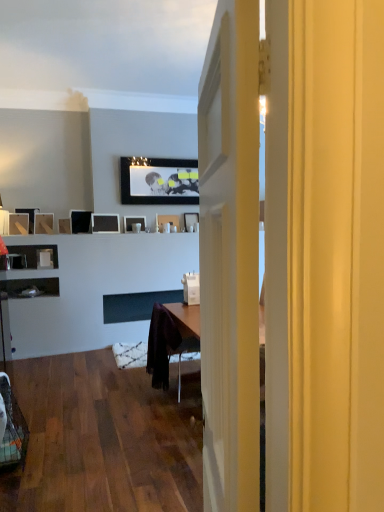
You are a GUI agent. You are given a task and a screenshot of the screen. Output one action in this format:
    pyautogui.click(x=<x>, y=<y>)
    Task: Click on the matte black picture frame at center, which ranks as the seventh picture frame in left-to-right order
    The image size is (384, 512).
    Given the screenshot: What is the action you would take?
    pyautogui.click(x=134, y=223)

Find the location of `matte black picture frame at center, placed as the fifth picture frame when sorted from left to right`. matte black picture frame at center, placed as the fifth picture frame when sorted from left to right is located at coordinates click(x=80, y=221).

Measure the distance between point (164, 358) and camera.

The distance of point (164, 358) from camera is 3.93 meters.

Where is `matte black picture frame at center, the fifth picture frame when ordered from right to left`? This screenshot has width=384, height=512. matte black picture frame at center, the fifth picture frame when ordered from right to left is located at coordinates (105, 223).

You are a GUI agent. You are given a task and a screenshot of the screen. Output one action in this format:
    pyautogui.click(x=<x>, y=<y>)
    Task: Click on the matte black picture frame at left, which is the tenth picture frame in right-to-left order
    The image size is (384, 512).
    Given the screenshot: What is the action you would take?
    pyautogui.click(x=29, y=216)

At what (x,y) coordinates should I click in order to perform the action: click on matte black picture frame at upper center, which ranks as the 8th picture frame in left-to-right order. Please return your answer as a coordinate pair (x, y). This screenshot has height=512, width=384. Looking at the image, I should click on (159, 181).

Considering the relative sizes of purple fabric chair at center and matte black picture frame at center, which ranks as the seventh picture frame in left-to-right order, in the image provided, is purple fabric chair at center thinner than matte black picture frame at center, which ranks as the seventh picture frame in left-to-right order,?

In fact, purple fabric chair at center might be wider than matte black picture frame at center, which ranks as the seventh picture frame in left-to-right order.

Is purple fabric chair at center completely or partially outside of matte black picture frame at center, which ranks as the seventh picture frame in left-to-right order?

Absolutely, purple fabric chair at center is external to matte black picture frame at center, which ranks as the seventh picture frame in left-to-right order.

From the image's perspective, is purple fabric chair at center located above or below matte black picture frame at center, which ranks as the seventh picture frame in left-to-right order?

Clearly, from the image's perspective, purple fabric chair at center is below matte black picture frame at center, which ranks as the seventh picture frame in left-to-right order.

Is purple fabric chair at center at the left side of matte black picture frame at center, which ranks as the 4th picture frame in right-to-left order?

No, purple fabric chair at center is not to the left of matte black picture frame at center, which ranks as the 4th picture frame in right-to-left order.

Who is smaller, matte wood picture frame at left, which is counted as the eighth picture frame, starting from the right, or matte black picture frame at upper center, which appears as the third picture frame when viewed from the right?

matte wood picture frame at left, which is counted as the eighth picture frame, starting from the right.

Is matte wood picture frame at left, which is counted as the eighth picture frame, starting from the right, shorter than matte black picture frame at upper center, which ranks as the 8th picture frame in left-to-right order?

Indeed, matte wood picture frame at left, which is counted as the eighth picture frame, starting from the right, has a lesser height compared to matte black picture frame at upper center, which ranks as the 8th picture frame in left-to-right order.

Can we say matte wood picture frame at left, the 3th picture frame positioned from the left, lies outside matte black picture frame at upper center, which ranks as the 8th picture frame in left-to-right order?

That's correct, matte wood picture frame at left, the 3th picture frame positioned from the left, is outside of matte black picture frame at upper center, which ranks as the 8th picture frame in left-to-right order.

Considering the relative sizes of matte wood picture frame at left, which is counted as the eighth picture frame, starting from the right, and matte black picture frame at upper center, which appears as the third picture frame when viewed from the right, in the image provided, is matte wood picture frame at left, which is counted as the eighth picture frame, starting from the right, thinner than matte black picture frame at upper center, which appears as the third picture frame when viewed from the right,?

No.

In the scene shown: Which is correct: matte wood picture frame at left, which is counted as the eighth picture frame, starting from the right, is inside matte black picture frame at left, positioned as the first picture frame in left-to-right order, or outside of it?

matte wood picture frame at left, which is counted as the eighth picture frame, starting from the right, exists outside the volume of matte black picture frame at left, positioned as the first picture frame in left-to-right order.

Considering the relative sizes of matte wood picture frame at left, the 3th picture frame positioned from the left, and matte black picture frame at left, positioned as the first picture frame in left-to-right order, in the image provided, is matte wood picture frame at left, the 3th picture frame positioned from the left, wider than matte black picture frame at left, positioned as the first picture frame in left-to-right order,?

Yes, matte wood picture frame at left, the 3th picture frame positioned from the left, is wider than matte black picture frame at left, positioned as the first picture frame in left-to-right order.

From the image's perspective, which is below, matte wood picture frame at left, which is counted as the eighth picture frame, starting from the right, or matte black picture frame at left, which is the tenth picture frame in right-to-left order?

matte wood picture frame at left, which is counted as the eighth picture frame, starting from the right, is shown below in the image.

Is matte wood picture frame at left, the 3th picture frame positioned from the left, not close to matte black picture frame at left, which is the tenth picture frame in right-to-left order?

That's not correct — matte wood picture frame at left, the 3th picture frame positioned from the left, is a little close to matte black picture frame at left, which is the tenth picture frame in right-to-left order.

Is matte black picture frame at left, positioned as the first picture frame in left-to-right order, positioned with its back to matte black picture frame at upper center, which appears as the third picture frame when viewed from the right?

No, matte black picture frame at left, positioned as the first picture frame in left-to-right order, is not facing away from matte black picture frame at upper center, which appears as the third picture frame when viewed from the right.

Considering the sizes of matte black picture frame at left, positioned as the first picture frame in left-to-right order, and matte black picture frame at upper center, which ranks as the 8th picture frame in left-to-right order, in the image, is matte black picture frame at left, positioned as the first picture frame in left-to-right order, wider or thinner than matte black picture frame at upper center, which ranks as the 8th picture frame in left-to-right order,?

In the image, matte black picture frame at left, positioned as the first picture frame in left-to-right order, appears to be wider than matte black picture frame at upper center, which ranks as the 8th picture frame in left-to-right order.

From the picture: Considering the relative sizes of matte black picture frame at left, which is the tenth picture frame in right-to-left order, and matte black picture frame at upper center, which appears as the third picture frame when viewed from the right, in the image provided, is matte black picture frame at left, which is the tenth picture frame in right-to-left order, bigger than matte black picture frame at upper center, which appears as the third picture frame when viewed from the right,?

No.

Between matte black picture frame at center, which ranks as the 4th picture frame in right-to-left order, and matte black picture frame at center, the 1th picture frame from the right, which one has larger size?

With larger size is matte black picture frame at center, which ranks as the 4th picture frame in right-to-left order.

Is the position of matte black picture frame at center, which ranks as the 4th picture frame in right-to-left order, less distant than that of matte black picture frame at center, marked as the 10th picture frame in a left-to-right arrangement?

Yes, matte black picture frame at center, which ranks as the 4th picture frame in right-to-left order, is closer to the camera.

Does point (129, 224) come in front of point (190, 222)?

Yes, it is.

From the matte black picture frame at center, marked as the 10th picture frame in a left-to-right arrangement, count the 3rd picture frame to the left and point to it. Please provide its 2D coordinates.

[(134, 223)]

In the image, is matte black picture frame at center, the ninth picture frame viewed from the left, on the left side or the right side of matte black picture frame at upper left, the fourth picture frame from the left?

matte black picture frame at center, the ninth picture frame viewed from the left, is positioned on matte black picture frame at upper left, the fourth picture frame from the left,'s right side.

From the image's perspective, between matte black picture frame at center, arranged as the 2th picture frame when viewed from the right, and matte black picture frame at upper left, the 7th picture frame positioned from the right, which one is located above?

matte black picture frame at center, arranged as the 2th picture frame when viewed from the right, is shown above in the image.

Is matte black picture frame at center, arranged as the 2th picture frame when viewed from the right, inside or outside of matte black picture frame at upper left, the fourth picture frame from the left?

matte black picture frame at center, arranged as the 2th picture frame when viewed from the right, is not inside matte black picture frame at upper left, the fourth picture frame from the left, it's outside.

Locate an element on the screen. This screenshot has height=512, width=384. swivel chair located below the matte black picture frame at center, marked as the 10th picture frame in a left-to-right arrangement (from the image's perspective) is located at coordinates (12, 428).

Is plastic mesh swivel chair at lower left wider than matte black picture frame at center, marked as the 10th picture frame in a left-to-right arrangement?

Yes.

How different are the orientations of plastic mesh swivel chair at lower left and matte black picture frame at center, the 1th picture frame from the right, in degrees?

92.9 degrees separate the facing orientations of plastic mesh swivel chair at lower left and matte black picture frame at center, the 1th picture frame from the right.

Considering the relative positions of plastic mesh swivel chair at lower left and matte black picture frame at center, marked as the 10th picture frame in a left-to-right arrangement, in the image provided, is plastic mesh swivel chair at lower left to the right of matte black picture frame at center, marked as the 10th picture frame in a left-to-right arrangement, from the viewer's perspective?

No, plastic mesh swivel chair at lower left is not to the right of matte black picture frame at center, marked as the 10th picture frame in a left-to-right arrangement.

Which picture frame is the 3rd one when counting from the left side of the purple fabric chair at center? Please provide its 2D coordinates.

[(134, 223)]

There is a matte wood picture frame at left, the 3th picture frame positioned from the left. What are the coordinates of `the 7th picture frame above it (from the image's perspective)` in the screenshot? It's located at (159, 181).

When comparing their distances from matte black picture frame at center, marked as the 10th picture frame in a left-to-right arrangement, does matte black picture frame at center, the ninth picture frame viewed from the left, or plastic mesh swivel chair at lower left seem further?

plastic mesh swivel chair at lower left is positioned further to the anchor matte black picture frame at center, marked as the 10th picture frame in a left-to-right arrangement.

Looking at this image, looking at the image, which one is located closer to matte black picture frame at center, the ninth picture frame viewed from the left, matte black picture frame at center, which ranks as the 4th picture frame in right-to-left order, or matte wood picture frame at left, which is counted as the eighth picture frame, starting from the right?

matte black picture frame at center, which ranks as the 4th picture frame in right-to-left order.

Looking at this image, looking at the image, which one is located further to plastic mesh swivel chair at lower left, purple fabric chair at center or matte black picture frame at center, the fifth picture frame when ordered from right to left?

matte black picture frame at center, the fifth picture frame when ordered from right to left.

Which object lies further to the anchor point matte black picture frame at center, the sixth picture frame from the left, matte black picture frame at center, the ninth picture frame viewed from the left, or plastic mesh swivel chair at lower left?

The object further to matte black picture frame at center, the sixth picture frame from the left, is plastic mesh swivel chair at lower left.

Estimate the real-world distances between objects in this image. Which object is closer to matte wood picture frame at left, the 3th picture frame positioned from the left, matte black picture frame at upper left, the fourth picture frame from the left, or matte black picture frame at center, the sixth picture frame from the left?

matte black picture frame at upper left, the fourth picture frame from the left.

Based on their spatial positions, is matte black picture frame at center, the 1th picture frame from the right, or matte wooden picture frame at left, placed as the second picture frame when sorted from left to right, closer to matte black picture frame at left, which is the tenth picture frame in right-to-left order?

matte wooden picture frame at left, placed as the second picture frame when sorted from left to right.

Consider the image. Estimate the real-world distances between objects in this image. Which object is closer to matte black picture frame at left, which is the tenth picture frame in right-to-left order, matte wood picture frame at left, the 3th picture frame positioned from the left, or matte black picture frame at center, which is counted as the 6th picture frame, starting from the right?

The object closer to matte black picture frame at left, which is the tenth picture frame in right-to-left order, is matte wood picture frame at left, the 3th picture frame positioned from the left.

Based on their spatial positions, is matte black picture frame at center, the ninth picture frame viewed from the left, or matte black picture frame at upper left, the fourth picture frame from the left, further from matte wooden picture frame at left, arranged as the ninth picture frame when viewed from the right?

Based on the image, matte black picture frame at center, the ninth picture frame viewed from the left, appears to be further to matte wooden picture frame at left, arranged as the ninth picture frame when viewed from the right.

Locate an element on the screen. picture frame between matte wooden picture frame at left, placed as the second picture frame when sorted from left to right, and matte black picture frame at upper left, the fourth picture frame from the left is located at coordinates point(44,223).

The height and width of the screenshot is (512, 384). I want to click on picture frame situated between matte wood picture frame at left, the 3th picture frame positioned from the left, and matte black picture frame at center, which is counted as the 6th picture frame, starting from the right, from left to right, so click(64, 226).

At what (x,y) coordinates should I click in order to perform the action: click on picture frame situated between matte black picture frame at left, positioned as the first picture frame in left-to-right order, and matte wood picture frame at left, which is counted as the eighth picture frame, starting from the right, from left to right. Please return your answer as a coordinate pair (x, y). Looking at the image, I should click on (18, 224).

Where is `chair between matte black picture frame at left, positioned as the first picture frame in left-to-right order, and matte black picture frame at center, marked as the 10th picture frame in a left-to-right arrangement`? The width and height of the screenshot is (384, 512). chair between matte black picture frame at left, positioned as the first picture frame in left-to-right order, and matte black picture frame at center, marked as the 10th picture frame in a left-to-right arrangement is located at coordinates (167, 344).